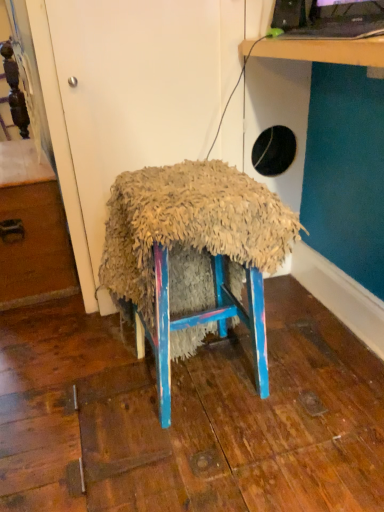
Where is `wooden table at upper right`? wooden table at upper right is located at coordinates (320, 50).

What is the approximate height of fuzzy fabric stool at center?

It is 75.02 centimeters.

Find the location of a particular element. black glossy desktop computer at upper right is located at coordinates (329, 18).

This screenshot has height=512, width=384. What are the coordinates of `wooden table at upper right` in the screenshot? It's located at (320, 50).

From the image's perspective, is wooden drawer at left located beneath fuzzy fabric stool at center?

No, from the image's perspective, wooden drawer at left is not beneath fuzzy fabric stool at center.

Is wooden drawer at left facing away from fuzzy fabric stool at center?

No, wooden drawer at left's orientation is not away from fuzzy fabric stool at center.

In terms of size, does wooden drawer at left appear bigger or smaller than fuzzy fabric stool at center?

Considering their sizes, wooden drawer at left takes up more space than fuzzy fabric stool at center.

Does wooden drawer at left appear on the left side of fuzzy fabric stool at center?

Yes, wooden drawer at left is to the left of fuzzy fabric stool at center.

At what (x,y) coordinates should I click in order to perform the action: click on furniture located in front of the wooden drawer at left. Please return your answer as a coordinate pair (x, y). This screenshot has width=384, height=512. Looking at the image, I should click on (193, 258).

Which is more to the left, fuzzy fabric stool at center or wooden drawer at left?

wooden drawer at left is more to the left.

Is fuzzy fabric stool at center behind wooden drawer at left?

No, fuzzy fabric stool at center is in front of wooden drawer at left.

Is black glossy desktop computer at upper right directly adjacent to wooden drawer at left?

No, black glossy desktop computer at upper right is not next to wooden drawer at left.

Is black glossy desktop computer at upper right positioned beyond the bounds of wooden drawer at left?

Yes, black glossy desktop computer at upper right is not within wooden drawer at left.

Based on the photo, is black glossy desktop computer at upper right facing towards wooden drawer at left?

No.

Does black glossy desktop computer at upper right have a greater height compared to wooden drawer at left?

No, black glossy desktop computer at upper right is not taller than wooden drawer at left.

This screenshot has height=512, width=384. What are the coordinates of `desktop computer on the left of wooden table at upper right` in the screenshot? It's located at (329, 18).

Can you confirm if wooden table at upper right is positioned to the right of black glossy desktop computer at upper right?

Correct, you'll find wooden table at upper right to the right of black glossy desktop computer at upper right.

Does wooden table at upper right have a smaller size compared to black glossy desktop computer at upper right?

Actually, wooden table at upper right might be larger than black glossy desktop computer at upper right.

Is black glossy desktop computer at upper right at the back of wooden table at upper right?

No, wooden table at upper right's orientation is not away from black glossy desktop computer at upper right.

From their relative heights in the image, would you say black glossy desktop computer at upper right is taller or shorter than wooden table at upper right?

black glossy desktop computer at upper right is shorter than wooden table at upper right.

From a real-world perspective, is black glossy desktop computer at upper right above or below wooden table at upper right?

From a real-world perspective, black glossy desktop computer at upper right is physically above wooden table at upper right.

Looking at this image, considering the relative sizes of black glossy desktop computer at upper right and wooden table at upper right in the image provided, is black glossy desktop computer at upper right smaller than wooden table at upper right?

Yes, black glossy desktop computer at upper right is smaller than wooden table at upper right.

Consider the image. Is black glossy desktop computer at upper right directly adjacent to wooden table at upper right?

black glossy desktop computer at upper right and wooden table at upper right are not in contact.

Is point (280, 52) behind point (123, 264)?

No, (280, 52) is in front of (123, 264).

Considering the relative positions of wooden table at upper right and fuzzy fabric stool at center in the image provided, is wooden table at upper right to the right of fuzzy fabric stool at center from the viewer's perspective?

Correct, you'll find wooden table at upper right to the right of fuzzy fabric stool at center.

Does wooden table at upper right have a lesser width compared to fuzzy fabric stool at center?

Indeed, wooden table at upper right has a lesser width compared to fuzzy fabric stool at center.

Is wooden table at upper right placed right next to fuzzy fabric stool at center?

wooden table at upper right is not next to fuzzy fabric stool at center, and they're not touching.

Which object is more forward, wooden table at upper right or wooden drawer at left?

wooden table at upper right is closer to the camera.

From the picture: Can wooden drawer at left be found inside wooden table at upper right?

No, wooden drawer at left is not surrounded by wooden table at upper right.

In terms of width, does wooden table at upper right look wider or thinner when compared to wooden drawer at left?

In the image, wooden table at upper right appears to be more narrow than wooden drawer at left.

Is wooden table at upper right bigger or smaller than wooden drawer at left?

Clearly, wooden table at upper right is smaller in size than wooden drawer at left.

Image resolution: width=384 pixels, height=512 pixels. What are the coordinates of `furniture below the wooden drawer at left (from the image's perspective)` in the screenshot? It's located at (193, 258).

Locate an element on the screen. Image resolution: width=384 pixels, height=512 pixels. drawer lying on the left of fuzzy fabric stool at center is located at coordinates (35, 246).

Estimate the real-world distances between objects in this image. Which object is further from fuzzy fabric stool at center, black glossy desktop computer at upper right or wooden table at upper right?

Among the two, black glossy desktop computer at upper right is located further to fuzzy fabric stool at center.

Considering their positions, is black glossy desktop computer at upper right positioned further to fuzzy fabric stool at center than wooden drawer at left?

black glossy desktop computer at upper right.

Estimate the real-world distances between objects in this image. Which object is closer to fuzzy fabric stool at center, wooden drawer at left or black glossy desktop computer at upper right?

wooden drawer at left.

From the image, which object appears to be farther from fuzzy fabric stool at center, wooden table at upper right or black glossy desktop computer at upper right?

black glossy desktop computer at upper right.

When comparing their distances from black glossy desktop computer at upper right, does fuzzy fabric stool at center or wooden table at upper right seem further?

fuzzy fabric stool at center is further to black glossy desktop computer at upper right.

Estimate the real-world distances between objects in this image. Which object is closer to wooden table at upper right, black glossy desktop computer at upper right or fuzzy fabric stool at center?

black glossy desktop computer at upper right is positioned closer to the anchor wooden table at upper right.

Which object lies nearer to the anchor point wooden table at upper right, fuzzy fabric stool at center or black glossy desktop computer at upper right?

black glossy desktop computer at upper right is closer to wooden table at upper right.

Considering their positions, is wooden table at upper right positioned closer to wooden drawer at left than black glossy desktop computer at upper right?

wooden table at upper right lies closer to wooden drawer at left than the other object.

At what (x,y) coordinates should I click in order to perform the action: click on table between black glossy desktop computer at upper right and fuzzy fabric stool at center in the up-down direction. Please return your answer as a coordinate pair (x, y). This screenshot has height=512, width=384. Looking at the image, I should click on tap(320, 50).

Where is `desktop computer between wooden drawer at left and wooden table at upper right in the horizontal direction`? The height and width of the screenshot is (512, 384). desktop computer between wooden drawer at left and wooden table at upper right in the horizontal direction is located at coordinates (329, 18).

Where is `furniture between wooden drawer at left and black glossy desktop computer at upper right`? furniture between wooden drawer at left and black glossy desktop computer at upper right is located at coordinates (193, 258).

The image size is (384, 512). I want to click on furniture between wooden drawer at left and wooden table at upper right in the horizontal direction, so click(x=193, y=258).